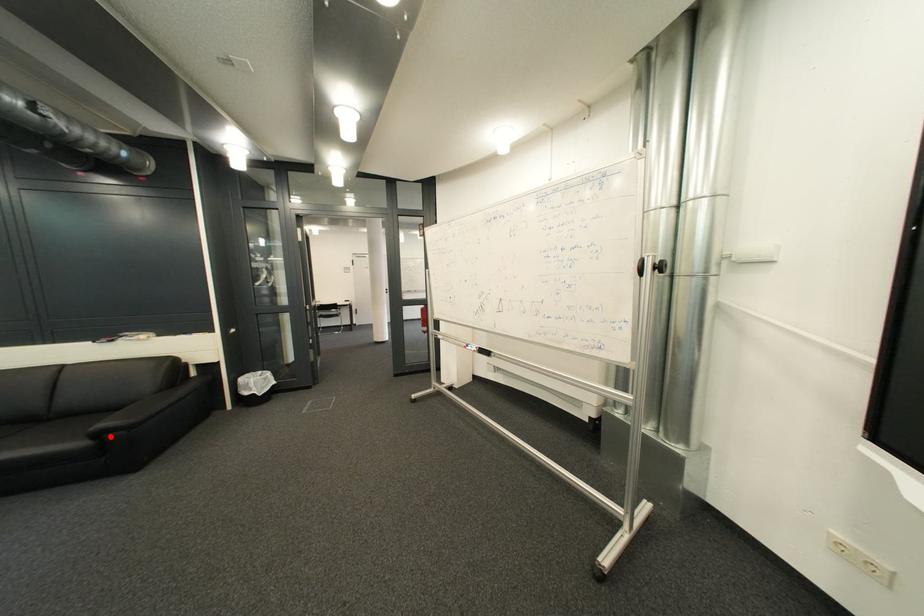
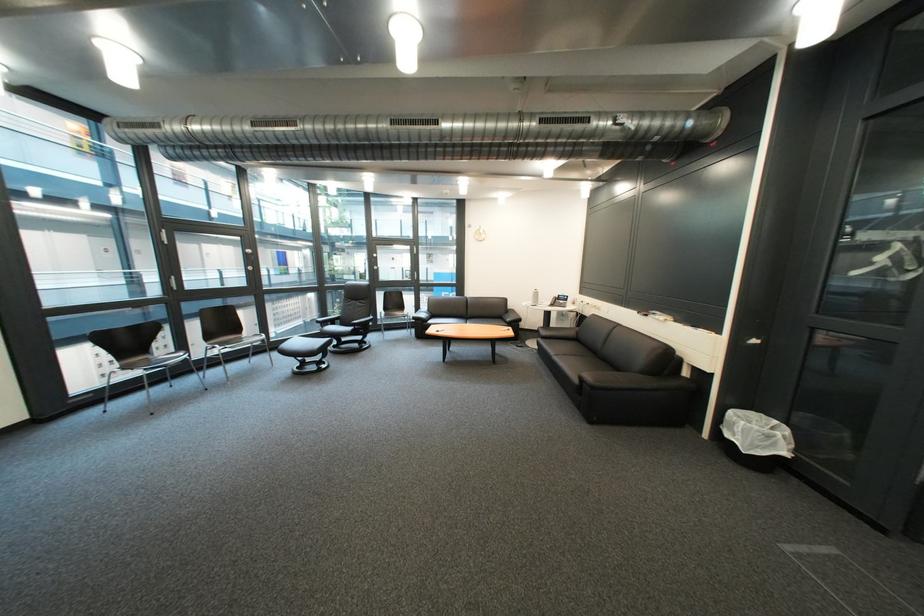
In the second image, find the point that corresponds to the highlighted location in the first image.

(594, 381)